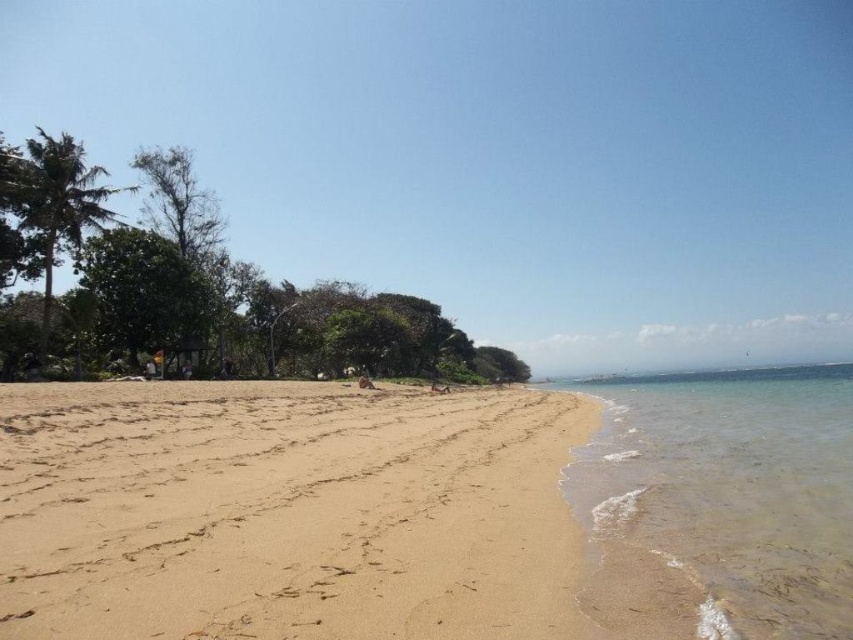
Is point (321, 429) more distant than point (750, 596)?

Yes, point (321, 429) is farther from viewer.

Find the location of a particular element. The width and height of the screenshot is (853, 640). light brown sand at center is located at coordinates (285, 515).

The height and width of the screenshot is (640, 853). In order to click on light brown sand at center in this screenshot , I will do `click(285, 515)`.

Locate an element on the screen. This screenshot has height=640, width=853. light brown sand at center is located at coordinates (285, 515).